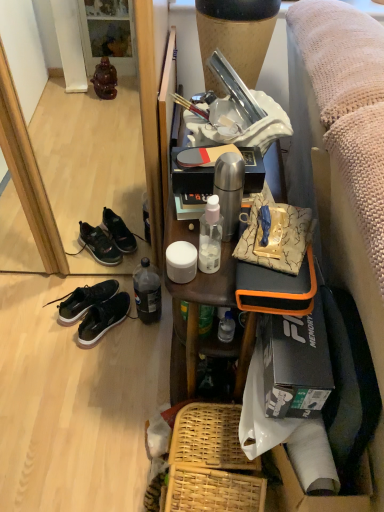
Question: Considering the relative sizes of matte black mirror at lower left and black matte sneakers at lower left in the image provided, is matte black mirror at lower left wider than black matte sneakers at lower left?

Choices:
 (A) no
 (B) yes

Answer: (B)

Question: Would you consider matte black mirror at lower left to be distant from black matte sneakers at lower left?

Choices:
 (A) yes
 (B) no

Answer: (B)

Question: Does matte black mirror at lower left lie in front of black matte sneakers at lower left?

Choices:
 (A) yes
 (B) no

Answer: (A)

Question: Can you confirm if matte black mirror at lower left is positioned to the right of black matte sneakers at lower left?

Choices:
 (A) no
 (B) yes

Answer: (A)

Question: From the image's perspective, is matte black mirror at lower left under black matte sneakers at lower left?

Choices:
 (A) no
 (B) yes

Answer: (A)

Question: Does point (375, 372) appear closer or farther from the camera than point (97, 303)?

Choices:
 (A) closer
 (B) farther

Answer: (A)

Question: From the image's perspective, relative to black matte sneakers at lower left, is textured beige fabric couch at right above or below?

Choices:
 (A) above
 (B) below

Answer: (A)

Question: Visually, is textured beige fabric couch at right positioned to the left or to the right of black matte sneakers at lower left?

Choices:
 (A) left
 (B) right

Answer: (B)

Question: In terms of width, does textured beige fabric couch at right look wider or thinner when compared to black matte sneakers at lower left?

Choices:
 (A) wide
 (B) thin

Answer: (A)

Question: In terms of width, does woven wood picnic basket at lower center look wider or thinner when compared to textured beige fabric couch at right?

Choices:
 (A) thin
 (B) wide

Answer: (A)

Question: Is woven wood picnic basket at lower center bigger or smaller than textured beige fabric couch at right?

Choices:
 (A) big
 (B) small

Answer: (B)

Question: From the image's perspective, relative to textured beige fabric couch at right, is woven wood picnic basket at lower center above or below?

Choices:
 (A) above
 (B) below

Answer: (B)

Question: Is point (216, 490) closer or farther from the camera than point (337, 80)?

Choices:
 (A) farther
 (B) closer

Answer: (A)

Question: From the image's perspective, relative to black matte sneakers at lower left, is matte black mirror at lower left above or below?

Choices:
 (A) above
 (B) below

Answer: (A)

Question: From a real-world perspective, is matte black mirror at lower left physically located above or below black matte sneakers at lower left?

Choices:
 (A) below
 (B) above

Answer: (B)